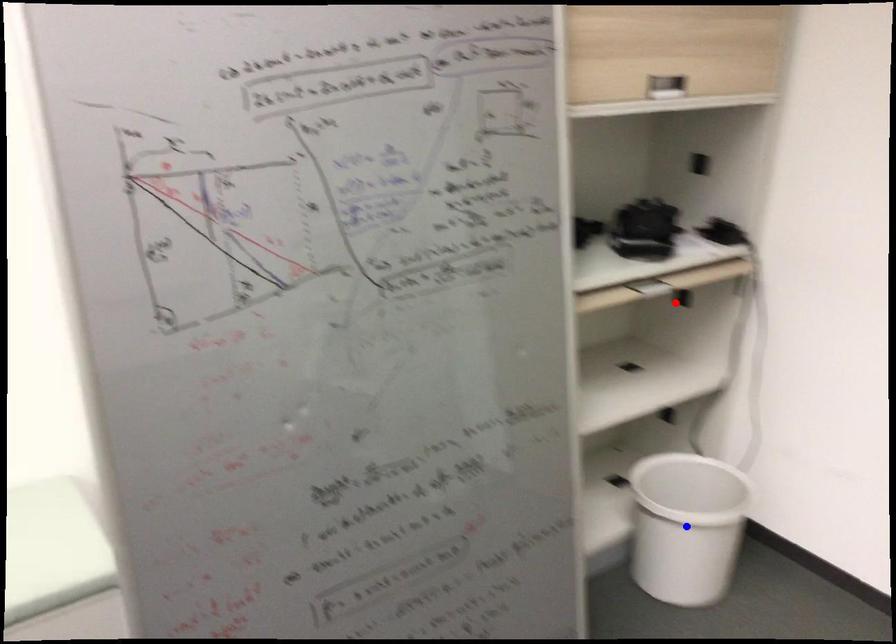
Question: Two points are marked on the image. Which point is closer to the camera?

Choices:
 (A) Blue point is closer.
 (B) Red point is closer.

Answer: (A)